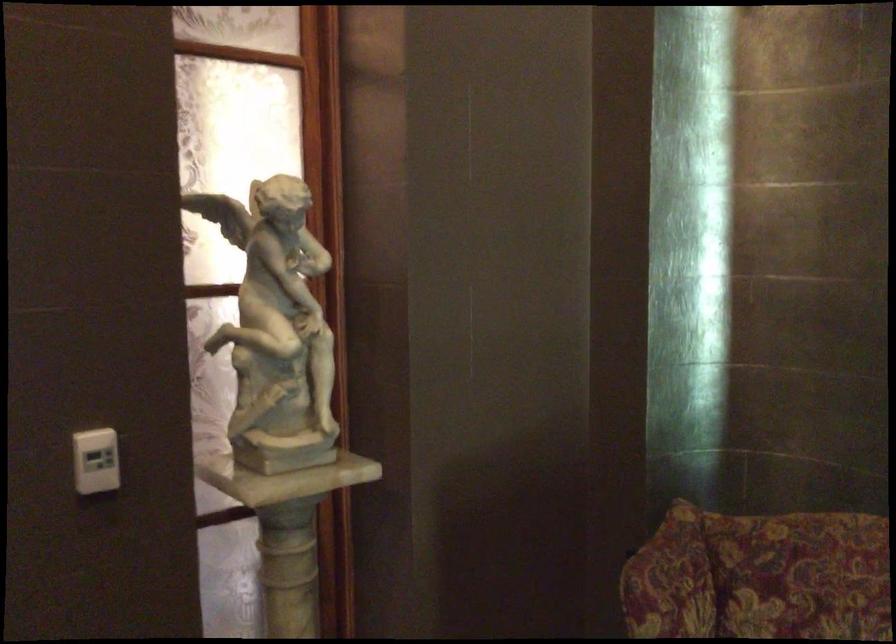
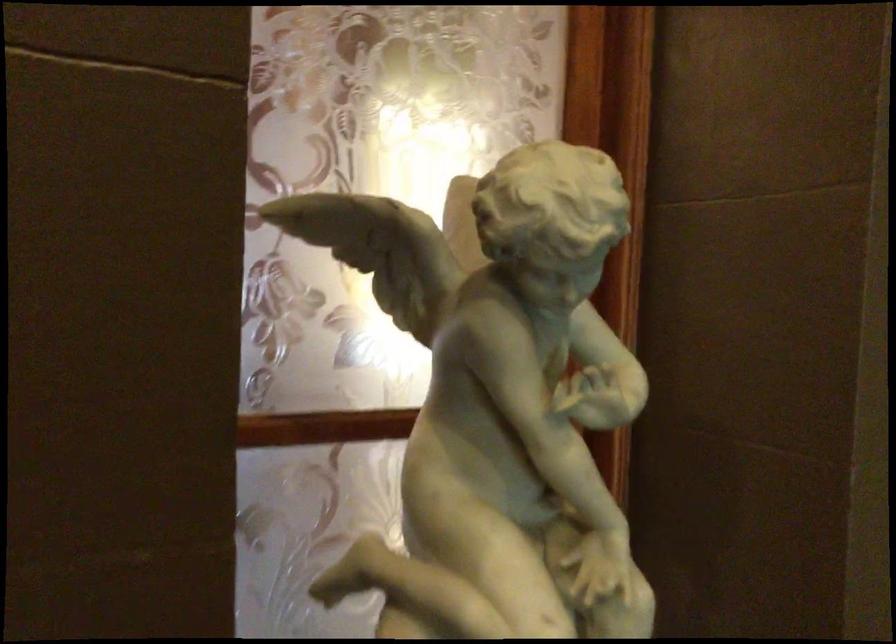
Question: In a continuous first-person perspective shot, in which direction is the camera moving?

Choices:
 (A) Left
 (B) Right
 (C) Forward
 (D) Backward

Answer: (C)